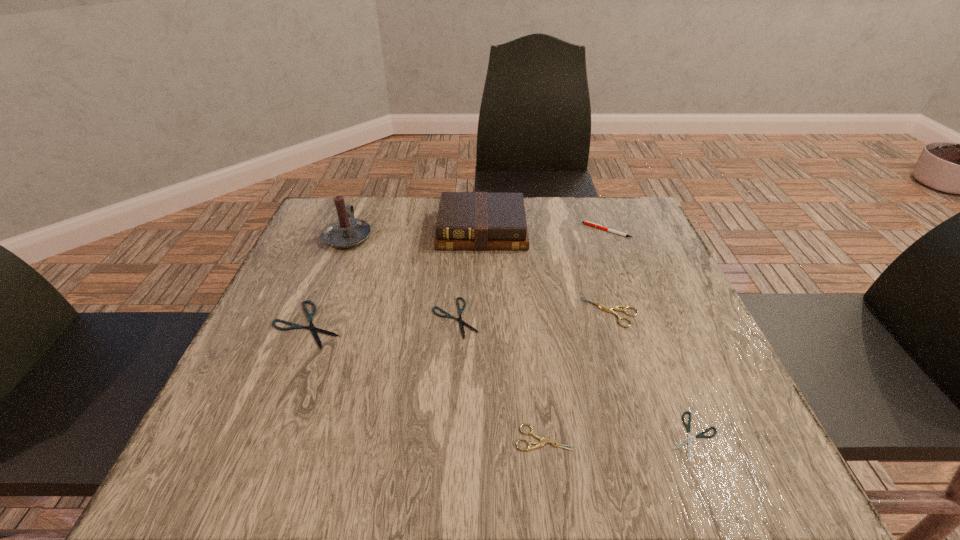
Locate an element on the screen. vacant region located 0.280m on the clicker of the pen is located at coordinates (476, 231).

At what (x,y) coordinates should I click in order to perform the action: click on vacant space located 0.210m on the front of the farther beige shears. Please return your answer as a coordinate pair (x, y). The width and height of the screenshot is (960, 540). Looking at the image, I should click on (644, 421).

Where is `free space located on the right of the leftmost shears`? This screenshot has width=960, height=540. free space located on the right of the leftmost shears is located at coordinates (388, 325).

Where is `vacant space located on the back of the third shears from left to right`? The height and width of the screenshot is (540, 960). vacant space located on the back of the third shears from left to right is located at coordinates (534, 349).

This screenshot has width=960, height=540. Identify the location of blank space located 0.230m on the front of the second biggest black shears. (447, 451).

Locate an element on the screen. free point located 0.110m on the back of the rightmost black shears is located at coordinates (663, 360).

Where is `candle present at the far edge`? The width and height of the screenshot is (960, 540). candle present at the far edge is located at coordinates (345, 232).

At what (x,y) coordinates should I click in order to perform the action: click on Bible at the far edge. Please return your answer as a coordinate pair (x, y). Looking at the image, I should click on (466, 220).

The height and width of the screenshot is (540, 960). Identify the location of pen located at the far edge. (585, 222).

Identify the location of candle present at the left edge. This screenshot has height=540, width=960. (345, 232).